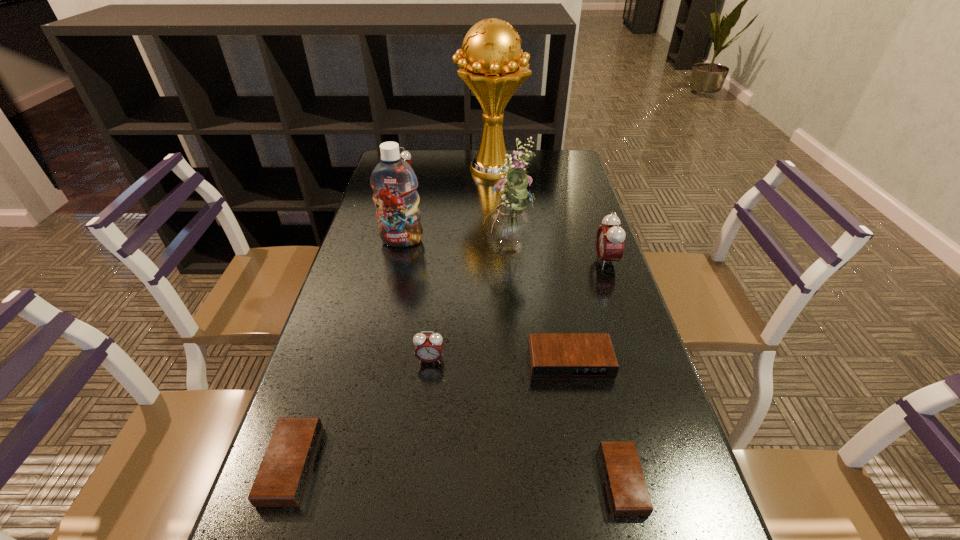
Find the location of `trophy_cup`. trophy_cup is located at coordinates (494, 66).

Find the location of a particular element. Image resolution: width=960 pixels, height=540 pixels. gold trophy_cup is located at coordinates (494, 66).

Where is `green bouquet`? green bouquet is located at coordinates (508, 226).

Image resolution: width=960 pixels, height=540 pixels. What are the coordinates of `the seventh shortest object` in the screenshot? It's located at (393, 181).

The image size is (960, 540). In order to click on blue shampoo in this screenshot , I will do `click(393, 181)`.

Where is `the rightmost alarm clock`? the rightmost alarm clock is located at coordinates (610, 238).

Find the location of a particular element. This screenshot has height=540, width=960. the tallest alarm clock is located at coordinates (610, 238).

Find the location of a particular element. The image size is (960, 540). the leftmost pink alarm clock is located at coordinates (405, 155).

I want to click on the second biggest pink alarm clock, so click(405, 155).

This screenshot has width=960, height=540. I want to click on the fourth alarm clock from right to left, so click(428, 348).